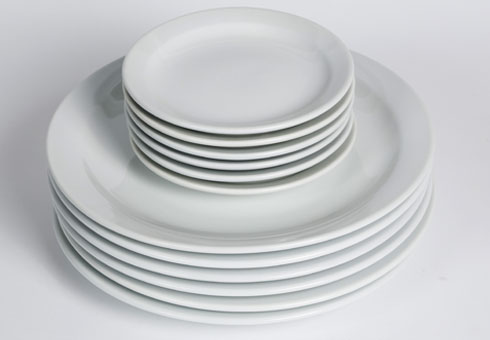
Identify the location of small plates. This screenshot has height=340, width=490. (240, 125), (247, 144), (245, 158), (234, 168), (235, 179), (263, 188).